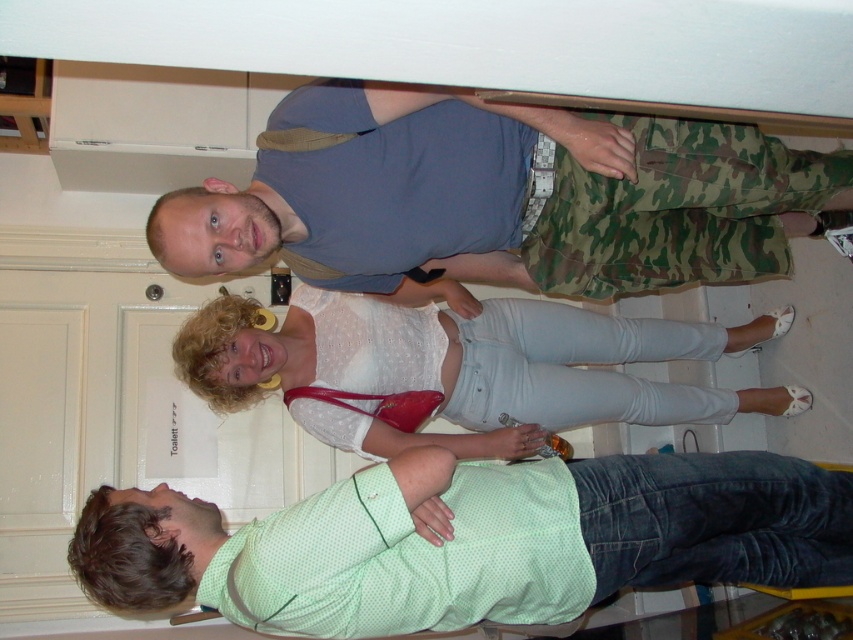
Question: Is camo-patterned shorts at upper center above white matte blouse at center?

Choices:
 (A) no
 (B) yes

Answer: (B)

Question: Based on their relative distances, which object is nearer to the white matte blouse at center?

Choices:
 (A) green dotted shirt at center
 (B) camo-patterned shorts at upper center

Answer: (B)

Question: Which is farther from the camo-patterned shorts at upper center?

Choices:
 (A) white matte blouse at center
 (B) green dotted shirt at center

Answer: (A)

Question: In this image, where is camo-patterned shorts at upper center located relative to green dotted shirt at center?

Choices:
 (A) above
 (B) below

Answer: (A)

Question: Which object is closer to the camera taking this photo?

Choices:
 (A) green dotted shirt at center
 (B) camo-patterned shorts at upper center

Answer: (B)

Question: Is camo-patterned shorts at upper center wider than white matte blouse at center?

Choices:
 (A) yes
 (B) no

Answer: (B)